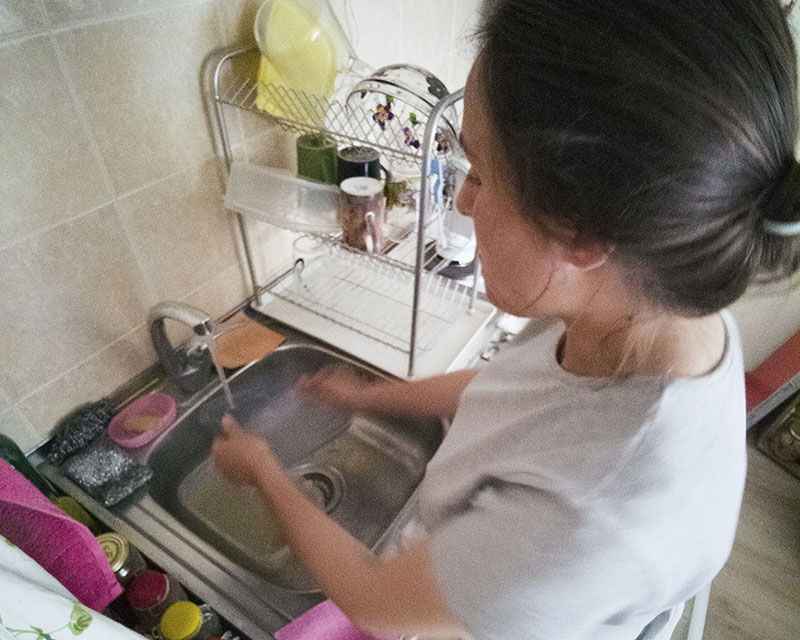
Identify the location of tile wall. (110, 256).